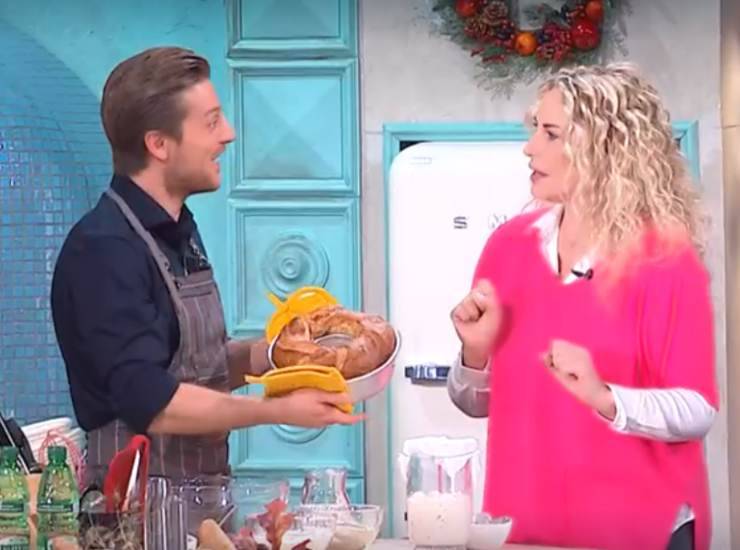
You are a GUI agent. You are given a task and a screenshot of the screen. Output one action in this format:
    pyautogui.click(x=<x>, y=<y>)
    Task: Click on the fridge handle
    This screenshot has width=740, height=550.
    Given the screenshot: What is the action you would take?
    pyautogui.click(x=423, y=370)